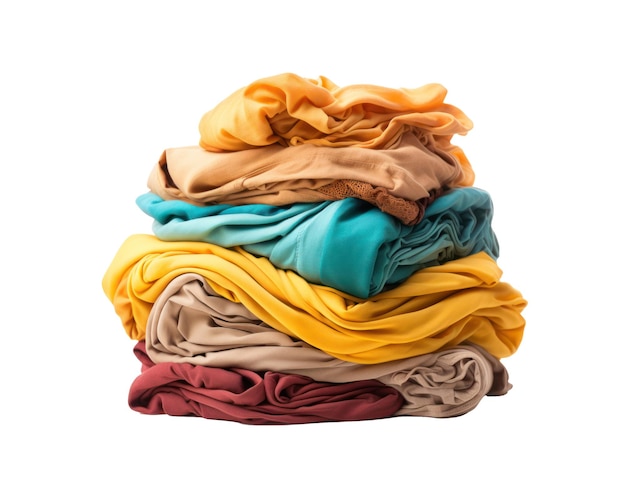
Identify the location of sheets. (269, 401), (297, 355), (381, 336), (350, 267), (357, 190), (335, 121).